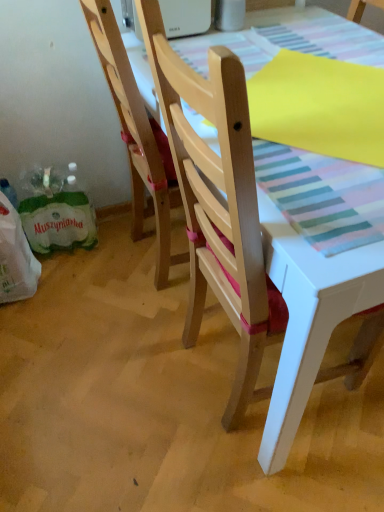
Question: In which direction should I rotate to look at natural wood chair at center, the 1th chair when ordered from left to right?

Choices:
 (A) right
 (B) left

Answer: (B)

Question: Considering the relative sizes of natural wood chair at center, arranged as the second chair when viewed from the right, and wooden chair at center, the second chair when ordered from left to right, in the image provided, is natural wood chair at center, arranged as the second chair when viewed from the right, thinner than wooden chair at center, the second chair when ordered from left to right,?

Choices:
 (A) yes
 (B) no

Answer: (A)

Question: Is natural wood chair at center, arranged as the second chair when viewed from the right, not inside wooden chair at center, the second chair when ordered from left to right?

Choices:
 (A) no
 (B) yes

Answer: (B)

Question: From the image's perspective, is natural wood chair at center, arranged as the second chair when viewed from the right, located above wooden chair at center, acting as the first chair starting from the right?

Choices:
 (A) yes
 (B) no

Answer: (A)

Question: Can you confirm if natural wood chair at center, the 1th chair when ordered from left to right, is bigger than wooden chair at center, the second chair when ordered from left to right?

Choices:
 (A) yes
 (B) no

Answer: (B)

Question: From a real-world perspective, is natural wood chair at center, the 1th chair when ordered from left to right, located beneath wooden chair at center, the second chair when ordered from left to right?

Choices:
 (A) no
 (B) yes

Answer: (B)

Question: Is wooden chair at center, the second chair when ordered from left to right, a part of natural wood chair at center, arranged as the second chair when viewed from the right?

Choices:
 (A) yes
 (B) no

Answer: (B)

Question: Is wooden chair at center, acting as the first chair starting from the right, thinner than green paper shopping bag at lower left?

Choices:
 (A) no
 (B) yes

Answer: (A)

Question: Is wooden chair at center, the second chair when ordered from left to right, wider than green paper shopping bag at lower left?

Choices:
 (A) yes
 (B) no

Answer: (A)

Question: From a real-world perspective, is wooden chair at center, acting as the first chair starting from the right, positioned under green paper shopping bag at lower left based on gravity?

Choices:
 (A) yes
 (B) no

Answer: (B)

Question: Does wooden chair at center, acting as the first chair starting from the right, appear on the right side of green paper shopping bag at lower left?

Choices:
 (A) yes
 (B) no

Answer: (A)

Question: Does wooden chair at center, the second chair when ordered from left to right, lie behind green paper shopping bag at lower left?

Choices:
 (A) no
 (B) yes

Answer: (A)

Question: Is wooden chair at center, acting as the first chair starting from the right, turned away from green paper shopping bag at lower left?

Choices:
 (A) no
 (B) yes

Answer: (A)

Question: Is green paper shopping bag at lower left bigger than wooden chair at center, acting as the first chair starting from the right?

Choices:
 (A) no
 (B) yes

Answer: (A)